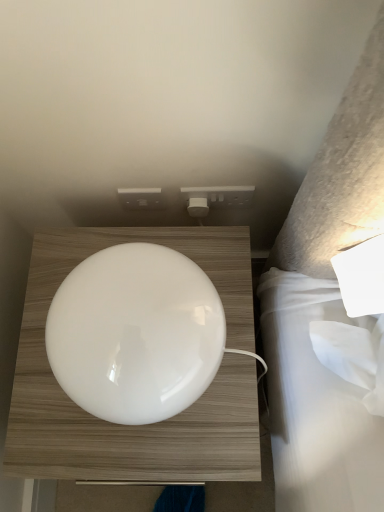
In order to face white glossy lampshade at center, should I rotate leftwards or rightwards?

Rotate your view left by about 5.059°.

Where is `white glossy lampshade at center`? This screenshot has width=384, height=512. white glossy lampshade at center is located at coordinates (145, 425).

Describe the element at coordinates (145, 425) in the screenshot. I see `white glossy lampshade at center` at that location.

The height and width of the screenshot is (512, 384). What do you see at coordinates (215, 197) in the screenshot?
I see `white plastic socket at upper center` at bounding box center [215, 197].

This screenshot has height=512, width=384. In order to click on white plastic socket at upper center in this screenshot , I will do 215,197.

Locate an element on the screen. This screenshot has width=384, height=512. white glossy lampshade at center is located at coordinates (145, 425).

Between white glossy lampshade at center and white plastic socket at upper center, which one appears on the right side from the viewer's perspective?

Positioned to the right is white plastic socket at upper center.

Who is more distant, white glossy lampshade at center or white plastic socket at upper center?

white plastic socket at upper center is further away from the camera.

Is point (45, 457) positioned before point (211, 201)?

Yes.

From the image's perspective, is white glossy lampshade at center above or below white plastic socket at upper center?

Based on their image positions, white glossy lampshade at center is located beneath white plastic socket at upper center.

From a real-world perspective, is white glossy lampshade at center under white plastic socket at upper center?

Yes, from a real-world perspective, white glossy lampshade at center is beneath white plastic socket at upper center.

Which of these two, white glossy lampshade at center or white plastic socket at upper center, is wider?

white glossy lampshade at center is wider.

Between white glossy lampshade at center and white plastic socket at upper center, which one has less height?

white plastic socket at upper center is shorter.

Considering the relative sizes of white glossy lampshade at center and white plastic socket at upper center in the image provided, is white glossy lampshade at center bigger than white plastic socket at upper center?

Yes.

Is white plastic socket at upper center inside white glossy lampshade at center?

No, white plastic socket at upper center is not surrounded by white glossy lampshade at center.

Is white glossy lampshade at center next to white plastic socket at upper center and touching it?

They are not placed beside each other.

Is white glossy lampshade at center facing towards white plastic socket at upper center?

No, white glossy lampshade at center does not turn towards white plastic socket at upper center.

How different are the orientations of white glossy lampshade at center and white plastic socket at upper center in degrees?

The angle between the facing direction of white glossy lampshade at center and the facing direction of white plastic socket at upper center is 0.473 degrees.

At what (x,y) coordinates should I click in order to perform the action: click on electric outlet located above the white glossy lampshade at center (from the image's perspective). Please return your answer as a coordinate pair (x, y). This screenshot has width=384, height=512. Looking at the image, I should click on (215, 197).

Can you confirm if white plastic socket at upper center is positioned to the right of white glossy lampshade at center?

Yes.

Considering the positions of objects white plastic socket at upper center and white glossy lampshade at center in the image provided, who is in front, white plastic socket at upper center or white glossy lampshade at center?

white glossy lampshade at center is closer to the camera.

Does point (250, 187) lie behind point (115, 434)?

Yes, point (250, 187) is farther from viewer.

From the image's perspective, does white plastic socket at upper center appear lower than white glossy lampshade at center?

No.

From a real-world perspective, is white plastic socket at upper center located beneath white glossy lampshade at center?

No, from a real-world perspective, white plastic socket at upper center is not beneath white glossy lampshade at center.

Considering the sizes of white plastic socket at upper center and white glossy lampshade at center in the image, is white plastic socket at upper center wider or thinner than white glossy lampshade at center?

Clearly, white plastic socket at upper center has less width compared to white glossy lampshade at center.

Considering the relative sizes of white plastic socket at upper center and white glossy lampshade at center in the image provided, is white plastic socket at upper center shorter than white glossy lampshade at center?

Indeed, white plastic socket at upper center has a lesser height compared to white glossy lampshade at center.

Between white plastic socket at upper center and white glossy lampshade at center, which one has larger size?

With larger size is white glossy lampshade at center.

Is white glossy lampshade at center a part of white plastic socket at upper center?

Actually, white glossy lampshade at center is outside white plastic socket at upper center.

Is white plastic socket at upper center next to white glossy lampshade at center and touching it?

No, white plastic socket at upper center is not next to white glossy lampshade at center.

Could you tell me if white plastic socket at upper center is facing white glossy lampshade at center?

Yes, white plastic socket at upper center is aimed at white glossy lampshade at center.

How many degrees apart are the facing directions of white plastic socket at upper center and white glossy lampshade at center?

0.473 degrees.

How distant is white plastic socket at upper center from white glossy lampshade at center?

white plastic socket at upper center and white glossy lampshade at center are 12.68 inches apart from each other.

This screenshot has width=384, height=512. I want to click on furniture below the white plastic socket at upper center (from a real-world perspective), so click(145, 425).

Where is `electric outlet behind the white glossy lampshade at center`? This screenshot has height=512, width=384. electric outlet behind the white glossy lampshade at center is located at coordinates (x=215, y=197).

Where is `electric outlet positioned vertically above the white glossy lampshade at center (from a real-world perspective)`? electric outlet positioned vertically above the white glossy lampshade at center (from a real-world perspective) is located at coordinates (215, 197).